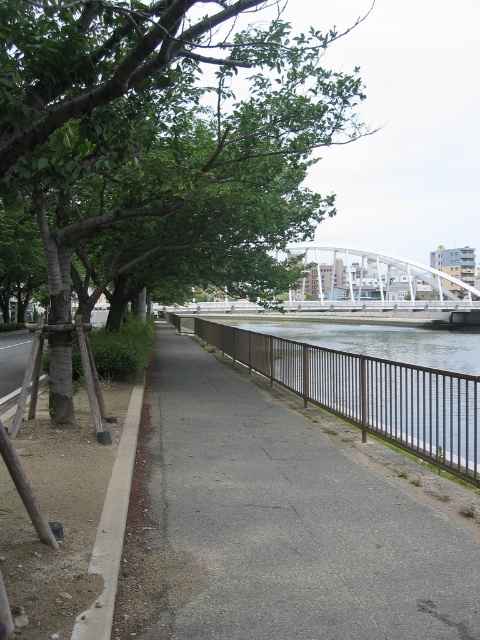
Question: Among these objects, which one is nearest to the camera?

Choices:
 (A) brown metal fence at center
 (B) white metallic bridge at center
 (C) gray asphalt pavement at center

Answer: (C)

Question: Is green leafy tree at upper left to the left of white metallic bridge at center from the viewer's perspective?

Choices:
 (A) no
 (B) yes

Answer: (A)

Question: Does green leafy tree at upper left have a lesser width compared to gray concrete curb at lower left?

Choices:
 (A) no
 (B) yes

Answer: (A)

Question: Can you confirm if green leafy tree at upper left is positioned to the left of white metallic bridge at center?

Choices:
 (A) yes
 (B) no

Answer: (B)

Question: Among these objects, which one is nearest to the camera?

Choices:
 (A) brown metal fence at center
 (B) gray concrete curb at lower left
 (C) gray asphalt pavement at center

Answer: (B)

Question: Estimate the real-world distances between objects in this image. Which object is closer to the white metallic bridge at center?

Choices:
 (A) gray asphalt pavement at center
 (B) gray concrete curb at lower left
 (C) green leafy tree at upper left

Answer: (C)